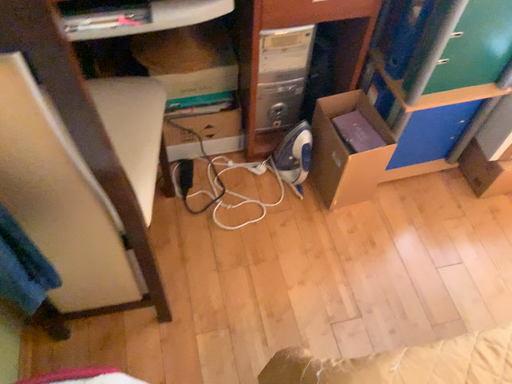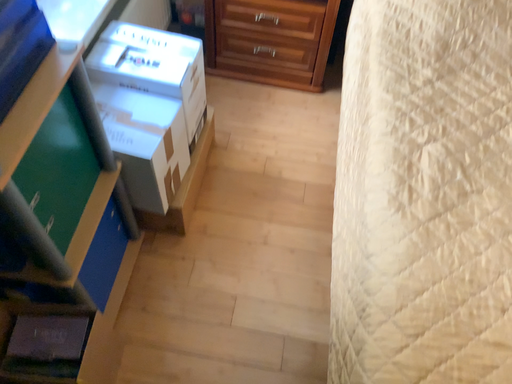
Question: Which way did the camera rotate in the video?

Choices:
 (A) rotated left
 (B) rotated right

Answer: (B)